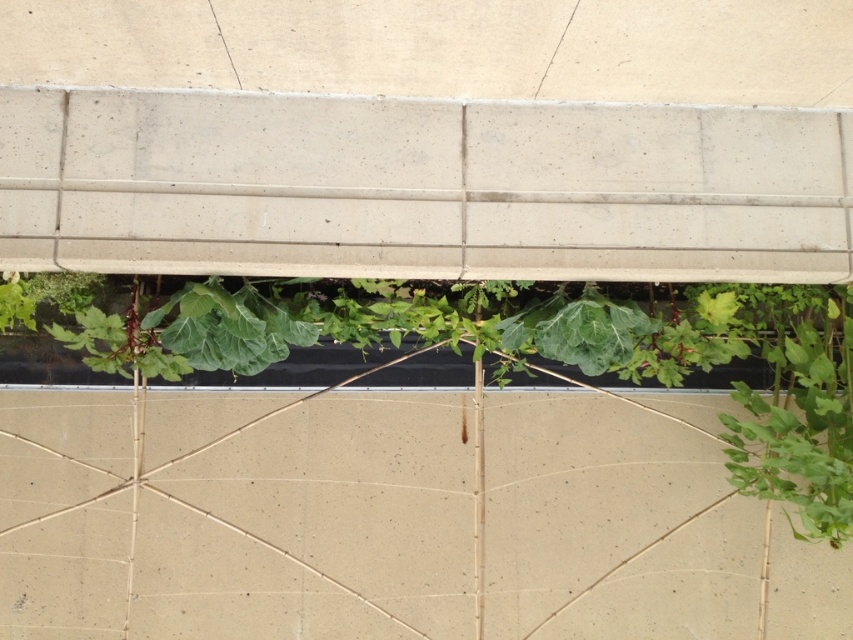
Is smooth beige concrete at center further to camera compared to green leafy plant at center?

Yes, smooth beige concrete at center is behind green leafy plant at center.

Between point (102, 627) and point (849, 337), which one is positioned in front?

Point (849, 337) is in front.

Who is more forward, [169,525] or [775,346]?

Positioned in front is point [775,346].

Where is `smooth beige concrete at center`? Image resolution: width=853 pixels, height=640 pixels. smooth beige concrete at center is located at coordinates (314, 528).